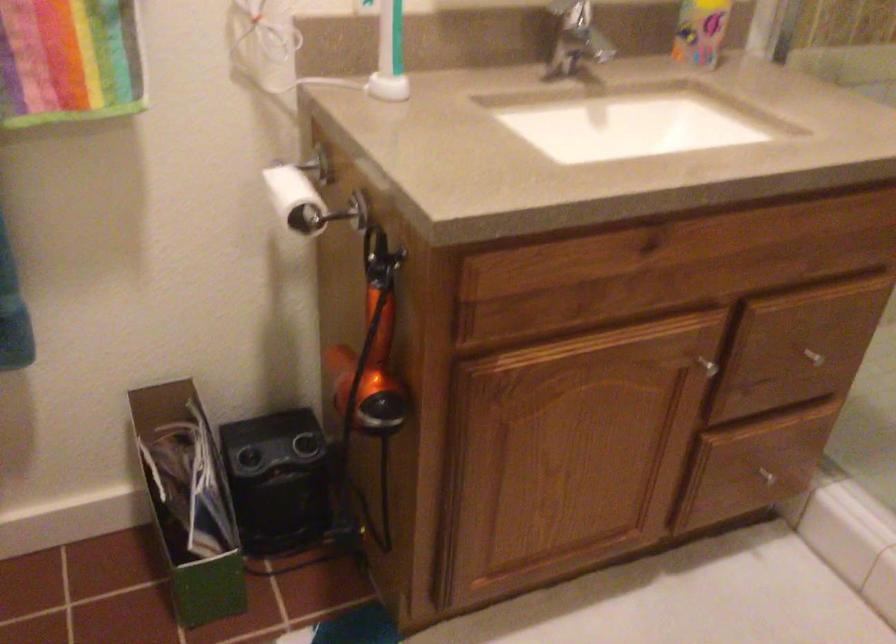
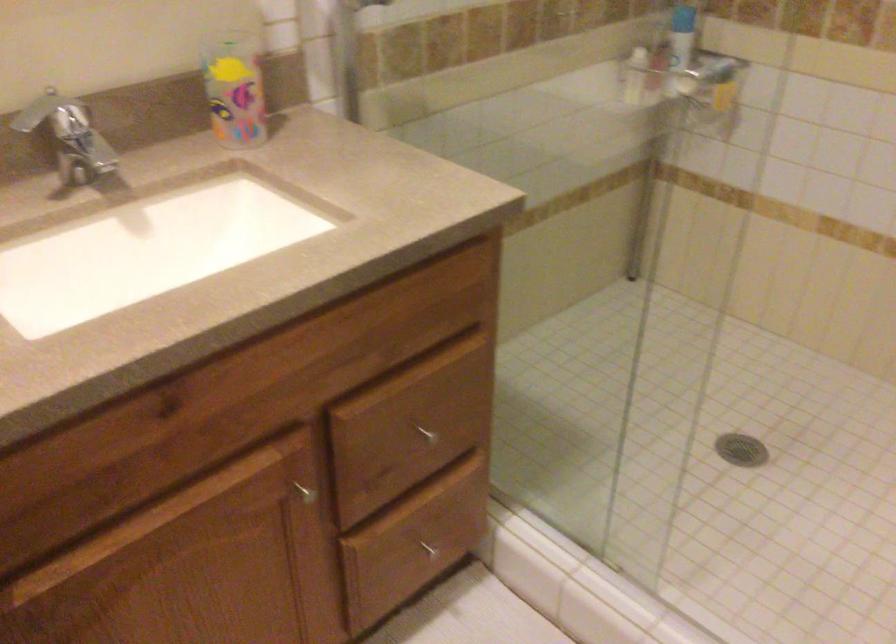
Question: Based on the continuous images, in which direction is the camera rotating? Reply with the corresponding letter.

Choices:
 (A) Left
 (B) Right
 (C) Up
 (D) Down

Answer: (B)